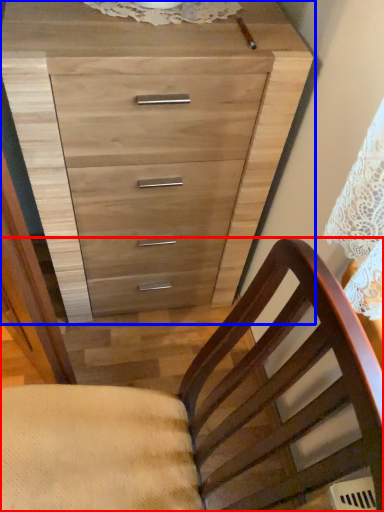
Question: Which object is closer to the camera taking this photo, chair (highlighted by a red box) or chest of drawers (highlighted by a blue box)?

Choices:
 (A) chair
 (B) chest of drawers

Answer: (A)